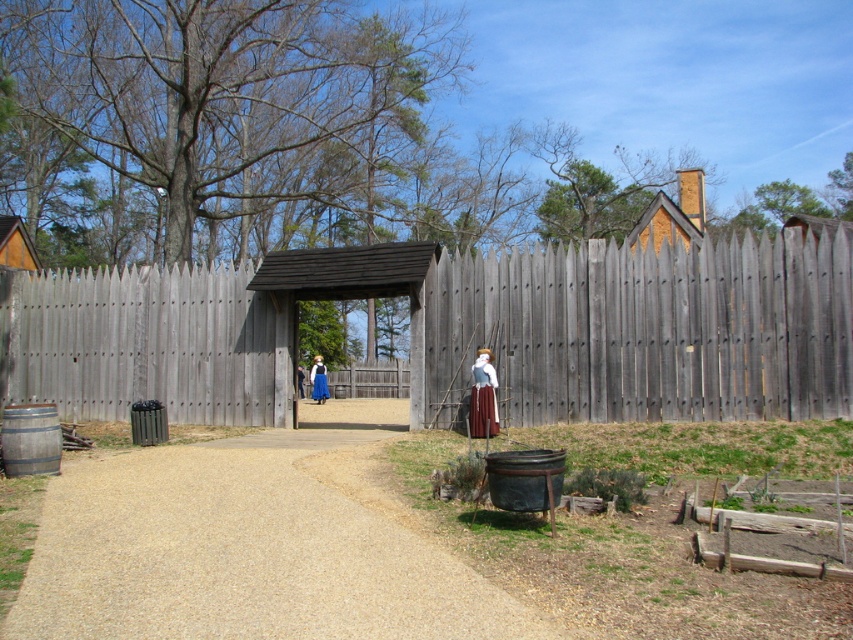
Looking at this image, who is more forward, (x=16, y=362) or (x=311, y=376)?

Point (x=16, y=362) is more forward.

Find the location of a particular element. gray wooden fence at center is located at coordinates (648, 330).

Which is behind, point (113, 305) or point (321, 380)?

Positioned behind is point (321, 380).

At what (x,y) coordinates should I click in order to perform the action: click on gray wooden fence at center. Please return your answer as a coordinate pair (x, y). The width and height of the screenshot is (853, 640). Looking at the image, I should click on (648, 330).

Who is positioned more to the left, gravel pathway at center or wooden hut at left?

wooden hut at left is more to the left.

Which is below, gravel pathway at center or wooden hut at left?

gravel pathway at center

Locate an element on the screen. The width and height of the screenshot is (853, 640). gravel pathway at center is located at coordinates (248, 545).

Does wooden barrel at lower left appear on the right side of wooden hut at left?

Yes, wooden barrel at lower left is to the right of wooden hut at left.

Is wooden barrel at lower left shorter than wooden hut at left?

Yes.

Between point (15, 424) and point (12, 216), which one is positioned in front?

Point (15, 424)

Find the location of a particular element. wooden barrel at lower left is located at coordinates (30, 440).